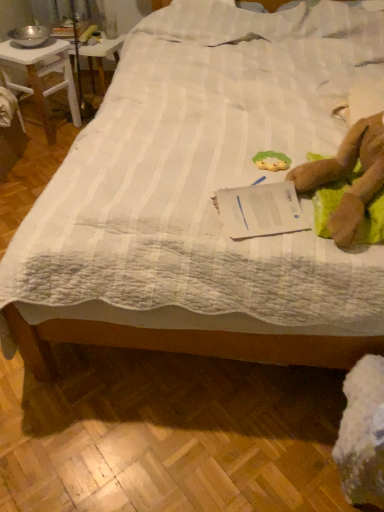
At what (x,y) coordinates should I click in order to perform the action: click on free point above white wood desk at upper left (from a real-world perspective). Please return your answer as a coordinate pair (x, y). Image resolution: width=384 pixels, height=512 pixels. Looking at the image, I should click on (29, 46).